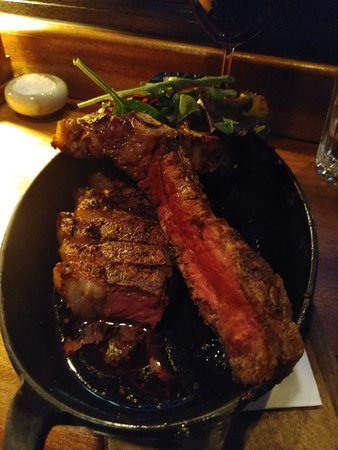
You are a GUI agent. You are given a task and a screenshot of the screen. Output one action in this format:
    pyautogui.click(x=<x>, y=<y>)
    Task: Click on the handle
    
    Given the screenshot: What is the action you would take?
    [x=24, y=426]